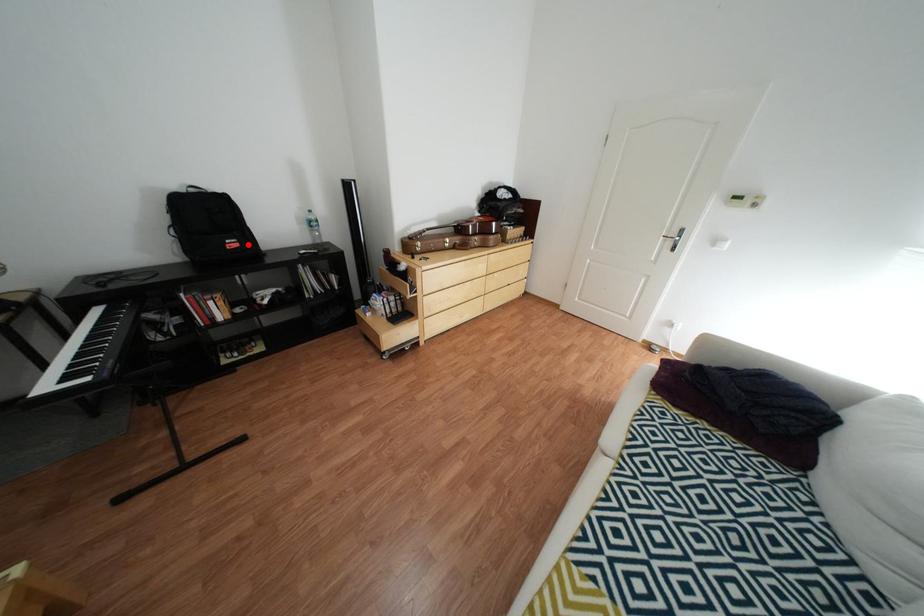
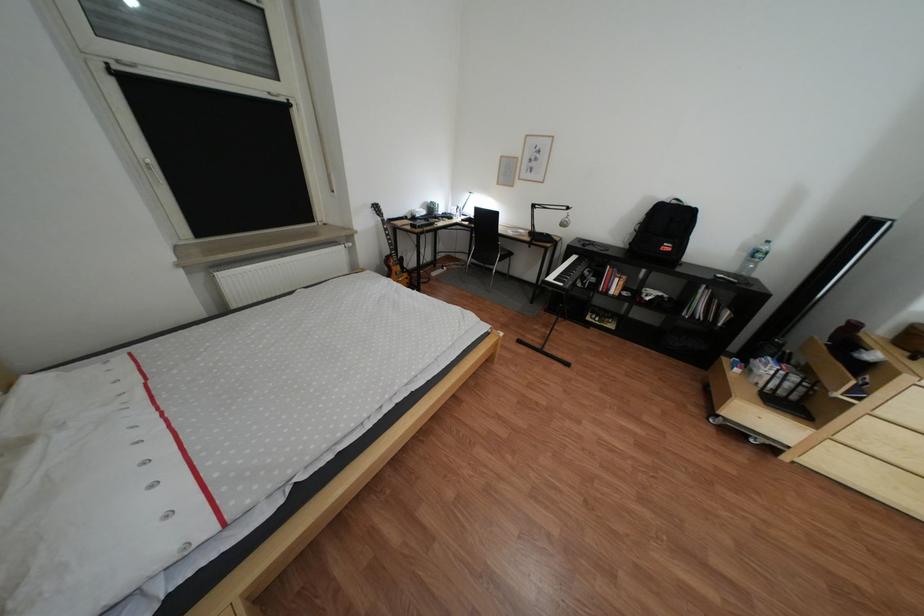
Question: I am providing you with two images of the same scene from different viewpoints. A red point is marked on the first image. At the location where the point appears in image 1, is it still visible in image 2?

Choices:
 (A) Yes
 (B) No

Answer: (A)